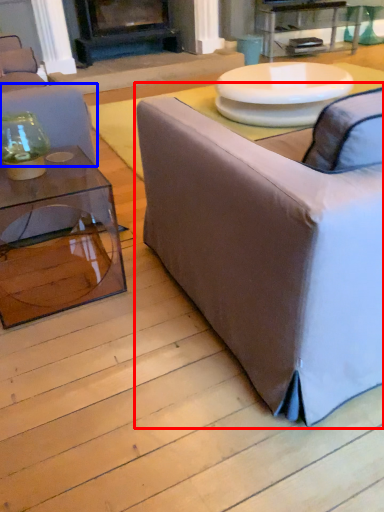
Question: Which object appears closest to the camera in this image, studio couch (highlighted by a red box) or studio couch (highlighted by a blue box)?

Choices:
 (A) studio couch
 (B) studio couch

Answer: (A)